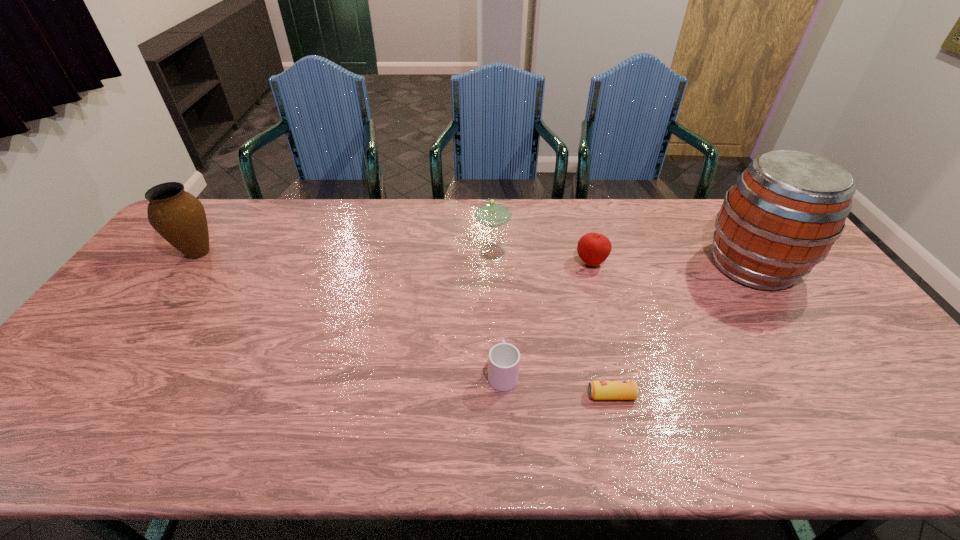
You are a GUI agent. You are given a task and a screenshot of the screen. Output one action in this format:
    pyautogui.click(x=<x>, y=<y>)
    Task: Click on the cider
    This screenshot has height=540, width=960.
    Given the screenshot: What is the action you would take?
    pyautogui.click(x=786, y=210)

The height and width of the screenshot is (540, 960). Identify the location of the tallest object. (786, 210).

At what (x,y) coordinates should I click in order to perform the action: click on urn. Please return your answer as a coordinate pair (x, y). Looking at the image, I should click on (179, 217).

Find the location of a particular element. the fifth shortest object is located at coordinates (179, 217).

Find the location of a particular element. The image size is (960, 540). the third tallest object is located at coordinates (493, 213).

You are a GUI agent. You are given a task and a screenshot of the screen. Output one action in this format:
    pyautogui.click(x=<x>, y=<y>)
    Task: Click on the apple
    The image size is (960, 540).
    Given the screenshot: What is the action you would take?
    point(593,248)

Where is `cup`? This screenshot has width=960, height=540. cup is located at coordinates pyautogui.click(x=504, y=359).

At what (x,y) coordinates should I click in order to perform the action: click on beer can. Please return your answer as a coordinate pair (x, y). Looking at the image, I should click on (598, 390).

Identify the location of free space located 0.240m on the left of the rightmost object. The height and width of the screenshot is (540, 960). (628, 265).

This screenshot has height=540, width=960. Identify the location of vacant space located 0.350m on the right of the leftmost object. (329, 253).